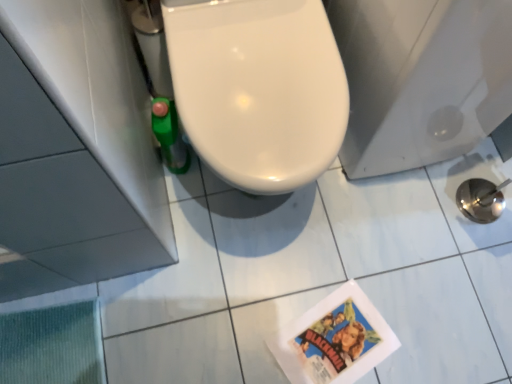
Question: Can you confirm if glossy ceramic tile at lower right is smaller than white glossy toilet at center?

Choices:
 (A) yes
 (B) no

Answer: (A)

Question: Could you tell me if glossy ceramic tile at lower right is facing white glossy toilet at center?

Choices:
 (A) no
 (B) yes

Answer: (A)

Question: Does glossy ceramic tile at lower right have a greater width compared to white glossy toilet at center?

Choices:
 (A) yes
 (B) no

Answer: (B)

Question: Does glossy ceramic tile at lower right appear on the right side of white glossy toilet at center?

Choices:
 (A) yes
 (B) no

Answer: (A)

Question: Does glossy ceramic tile at lower right have a lesser width compared to white glossy toilet at center?

Choices:
 (A) no
 (B) yes

Answer: (B)

Question: Is glossy ceramic tile at lower right looking in the opposite direction of white glossy toilet at center?

Choices:
 (A) no
 (B) yes

Answer: (A)

Question: From a real-world perspective, does white glossy toilet at center sit lower than glossy ceramic tile at lower right?

Choices:
 (A) yes
 (B) no

Answer: (B)

Question: From a real-world perspective, is white glossy toilet at center on top of glossy ceramic tile at lower right?

Choices:
 (A) yes
 (B) no

Answer: (A)

Question: Is white glossy toilet at center to the right of glossy ceramic tile at lower right from the viewer's perspective?

Choices:
 (A) yes
 (B) no

Answer: (B)

Question: From the image's perspective, is white glossy toilet at center above glossy ceramic tile at lower right?

Choices:
 (A) no
 (B) yes

Answer: (B)

Question: Is white glossy toilet at center wider than glossy ceramic tile at lower right?

Choices:
 (A) yes
 (B) no

Answer: (A)

Question: Can you confirm if white glossy toilet at center is bigger than glossy ceramic tile at lower right?

Choices:
 (A) yes
 (B) no

Answer: (A)

Question: Would you say white glossy toilet at center is to the left or to the right of glossy ceramic tile at lower right in the picture?

Choices:
 (A) right
 (B) left

Answer: (B)